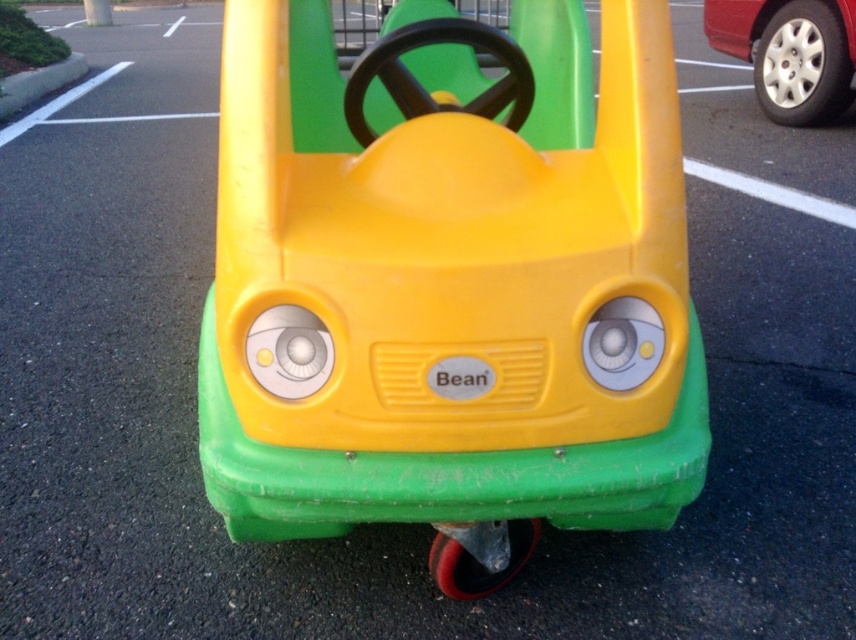
Question: From the image, what is the correct spatial relationship of yellow plastic toy car at center in relation to metallic silver wheel at upper right?

Choices:
 (A) right
 (B) left

Answer: (B)

Question: Among these points, which one is farthest from the camera?

Choices:
 (A) (768, 76)
 (B) (364, 145)

Answer: (A)

Question: Does yellow plastic toy car at center appear on the left side of metallic silver wheel at upper right?

Choices:
 (A) no
 (B) yes

Answer: (B)

Question: Is yellow plastic toy car at center wider than metallic silver wheel at upper right?

Choices:
 (A) yes
 (B) no

Answer: (A)

Question: Which object appears closest to the camera in this image?

Choices:
 (A) yellow plastic toy car at center
 (B) metallic silver wheel at upper right

Answer: (A)